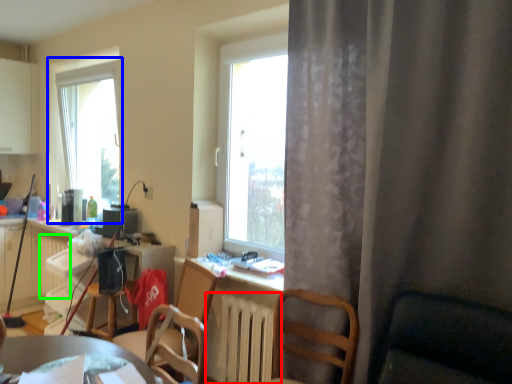
Question: Based on their relative distances, which object is nearer to radiator (highlighted by a red box)? Choose from window (highlighted by a blue box) and radiator (highlighted by a green box).

Choices:
 (A) window
 (B) radiator

Answer: (B)